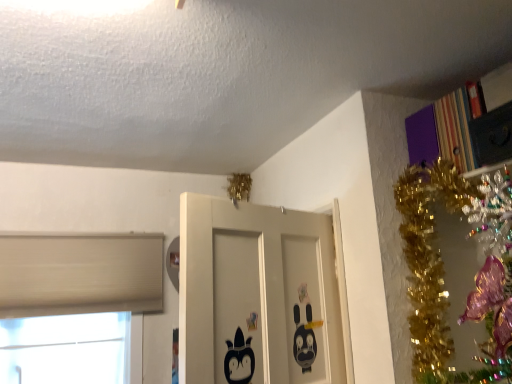
Question: Is point (218, 357) positioned closer to the camera than point (57, 248)?

Choices:
 (A) farther
 (B) closer

Answer: (B)

Question: Is black matte door at center wider or thinner than white matte window at lower left?

Choices:
 (A) thin
 (B) wide

Answer: (B)

Question: Based on their relative distances, which object is nearer to the black matte door at center?

Choices:
 (A) striped cardboard bookcase at upper right
 (B) white matte window at lower left

Answer: (A)

Question: Which of these objects is positioned farthest from the white matte window at lower left?

Choices:
 (A) striped cardboard bookcase at upper right
 (B) black matte door at center

Answer: (A)